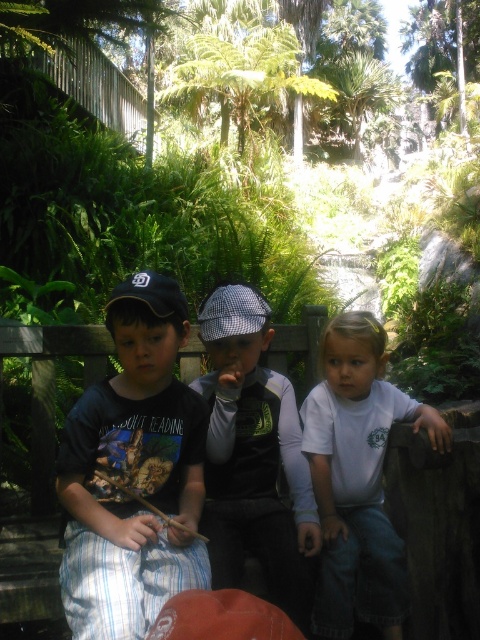
Question: Does dark blue cotton shirt at left have a smaller size compared to white cotton shirt at center?

Choices:
 (A) yes
 (B) no

Answer: (A)

Question: Which of the following is the closest to the observer?

Choices:
 (A) orange fabric baseball hat at lower center
 (B) checkered fabric cap at center
 (C) dark blue cotton shirt at left

Answer: (A)

Question: Can you confirm if white cotton shirt at center is positioned below orange fabric baseball hat at lower center?

Choices:
 (A) yes
 (B) no

Answer: (B)

Question: Which point is closer to the camera?

Choices:
 (A) (272, 612)
 (B) (372, 476)
 (C) (151, 328)

Answer: (A)

Question: Is checkered fabric cap at center wider than white cotton shirt at center?

Choices:
 (A) no
 (B) yes

Answer: (A)

Question: Estimate the real-world distances between objects in this image. Which object is closer to the orange fabric baseball hat at lower center?

Choices:
 (A) checkered fabric cap at center
 (B) dark blue cotton shirt at left

Answer: (B)